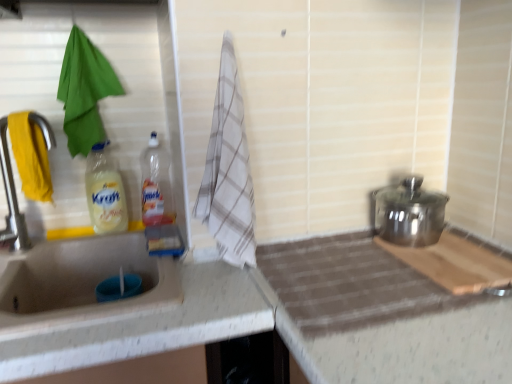
The height and width of the screenshot is (384, 512). Find the location of `blank space to the left of wooden cutting board at right`. blank space to the left of wooden cutting board at right is located at coordinates (347, 269).